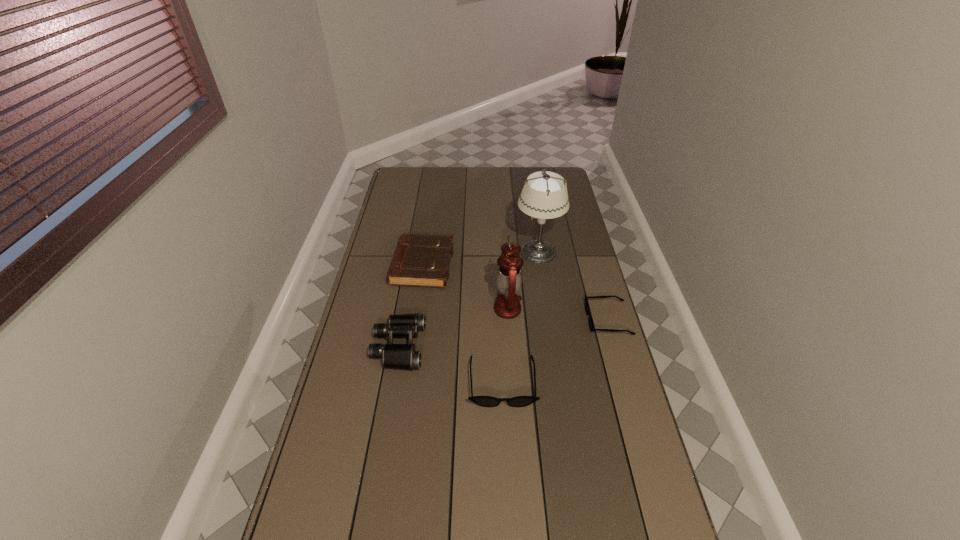
Please point a free position for a sunglasses on the left. Please provide its 2D coordinates. Your answer should be formatted as a tuple, i.e. [(x, y)], where the tuple contains the x and y coordinates of a point satisfying the conditions above.

[(362, 465)]